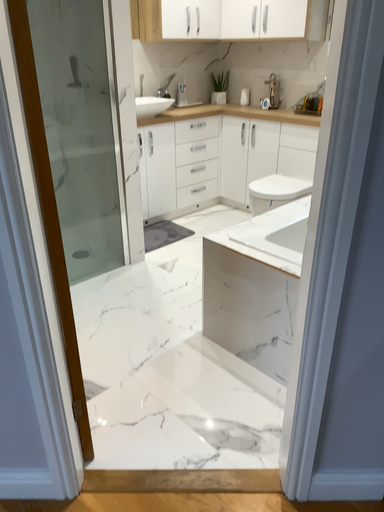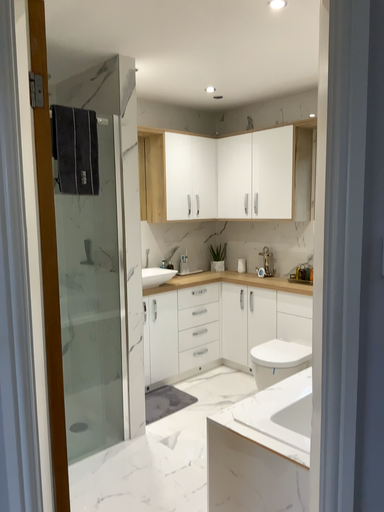
Question: Which way did the camera rotate in the video?

Choices:
 (A) rotated upward
 (B) rotated downward

Answer: (A)